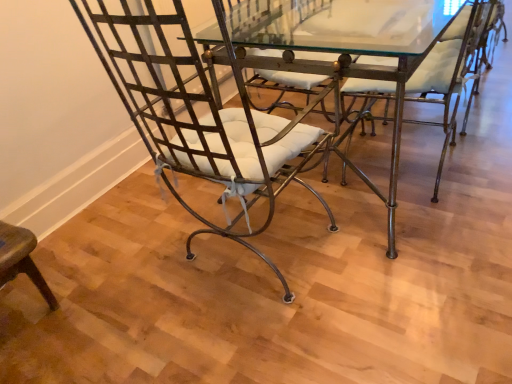
Question: Can you confirm if metallic/glass table at center is taller than metallic wrought iron chair at center, the 1th chair when ordered from right to left?

Choices:
 (A) yes
 (B) no

Answer: (B)

Question: From a real-world perspective, does metallic/glass table at center sit lower than metallic wrought iron chair at center, which is the 2th chair from left to right?

Choices:
 (A) yes
 (B) no

Answer: (A)

Question: From a real-world perspective, is metallic/glass table at center over metallic wrought iron chair at center, the 1th chair when ordered from right to left?

Choices:
 (A) no
 (B) yes

Answer: (A)

Question: From the image's perspective, is metallic/glass table at center located beneath metallic wrought iron chair at center, which is the 2th chair from left to right?

Choices:
 (A) no
 (B) yes

Answer: (A)

Question: Is metallic/glass table at center positioned beyond the bounds of metallic wrought iron chair at center, which is the 2th chair from left to right?

Choices:
 (A) yes
 (B) no

Answer: (A)

Question: Is metallic/glass table at center at the left side of metallic wrought iron chair at center, the 1th chair when ordered from right to left?

Choices:
 (A) yes
 (B) no

Answer: (A)

Question: Can you confirm if metallic wire chair at left, which appears as the second chair when viewed from the right, is shorter than metallic wrought iron chair at center, which is the 2th chair from left to right?

Choices:
 (A) no
 (B) yes

Answer: (A)

Question: Can you confirm if metallic wire chair at left, which appears as the second chair when viewed from the right, is thinner than metallic wrought iron chair at center, which is the 2th chair from left to right?

Choices:
 (A) yes
 (B) no

Answer: (B)

Question: From the image's perspective, is metallic wire chair at left, the 1th chair viewed from the left, located above metallic wrought iron chair at center, the 1th chair when ordered from right to left?

Choices:
 (A) yes
 (B) no

Answer: (B)

Question: Is metallic wire chair at left, which appears as the second chair when viewed from the right, surrounding metallic wrought iron chair at center, the 1th chair when ordered from right to left?

Choices:
 (A) yes
 (B) no

Answer: (B)

Question: From a real-world perspective, is metallic wire chair at left, which appears as the second chair when viewed from the right, below metallic wrought iron chair at center, the 1th chair when ordered from right to left?

Choices:
 (A) no
 (B) yes

Answer: (A)

Question: Does metallic wire chair at left, which appears as the second chair when viewed from the right, come behind metallic wrought iron chair at center, the 1th chair when ordered from right to left?

Choices:
 (A) yes
 (B) no

Answer: (B)

Question: From a real-world perspective, is metallic wrought iron chair at center, the 1th chair when ordered from right to left, positioned over metallic wire chair at left, which appears as the second chair when viewed from the right, based on gravity?

Choices:
 (A) yes
 (B) no

Answer: (B)